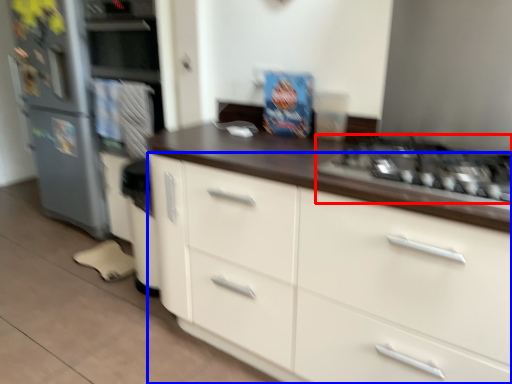
Question: Which point is further to the camera, gas stove (highlighted by a red box) or cabinetry (highlighted by a blue box)?

Choices:
 (A) gas stove
 (B) cabinetry

Answer: (A)